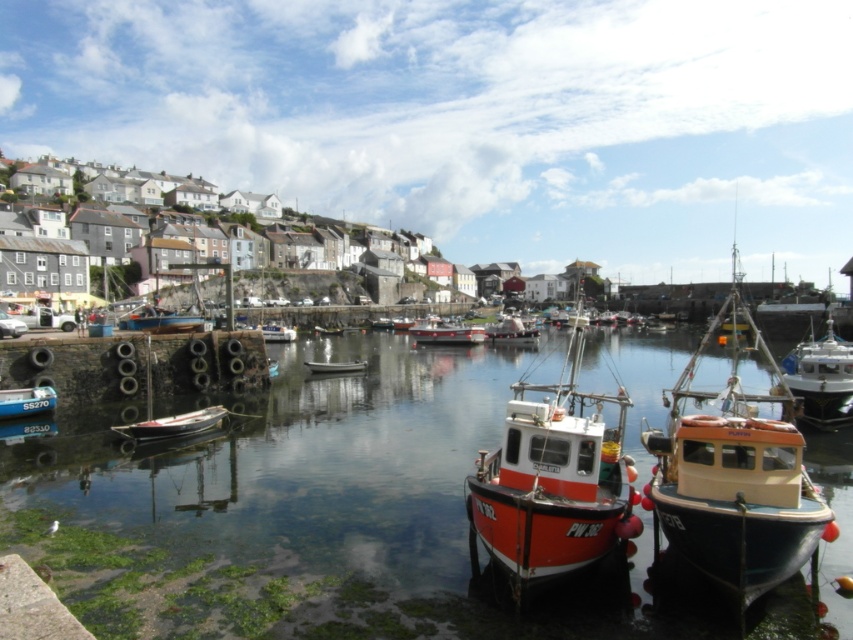
From the picture: Which is above, matte black boat at lower left or white matte boat at center?

white matte boat at center

Is point (49, 388) positioned in front of point (349, 369)?

Yes, it is in front of point (349, 369).

Image resolution: width=853 pixels, height=640 pixels. In order to click on matte black boat at lower left in this screenshot , I will do `click(26, 401)`.

Does clear water at center appear under blue wooden boat at center?

Yes, clear water at center is below blue wooden boat at center.

Is clear water at center behind blue wooden boat at center?

No.

Between point (152, 497) and point (126, 321), which one is positioned behind?

Point (126, 321)

Where is `clear water at center`? This screenshot has height=640, width=853. clear water at center is located at coordinates (314, 515).

Does white wooden boat at right appear on the right side of white matte boat at center?

Yes, white wooden boat at right is to the right of white matte boat at center.

Which of these two, white wooden boat at right or white matte boat at center, stands taller?

With more height is white wooden boat at right.

You are a GUI agent. You are given a task and a screenshot of the screen. Output one action in this format:
    pyautogui.click(x=<x>, y=<y>)
    Task: Click on the white wooden boat at right
    
    Given the screenshot: What is the action you would take?
    pyautogui.click(x=821, y=378)